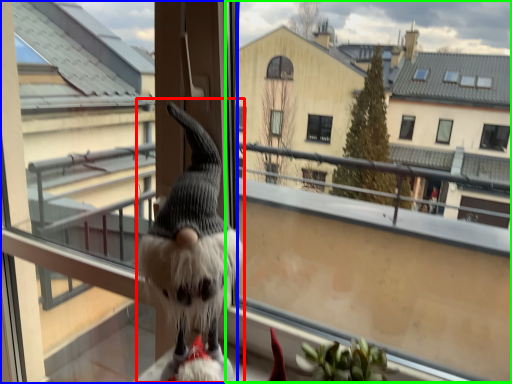
Question: Based on their relative distances, which object is farther from animal (highlighted by a red box)? Choose from screen door (highlighted by a blue box) and window screen (highlighted by a green box).

Choices:
 (A) screen door
 (B) window screen

Answer: (B)